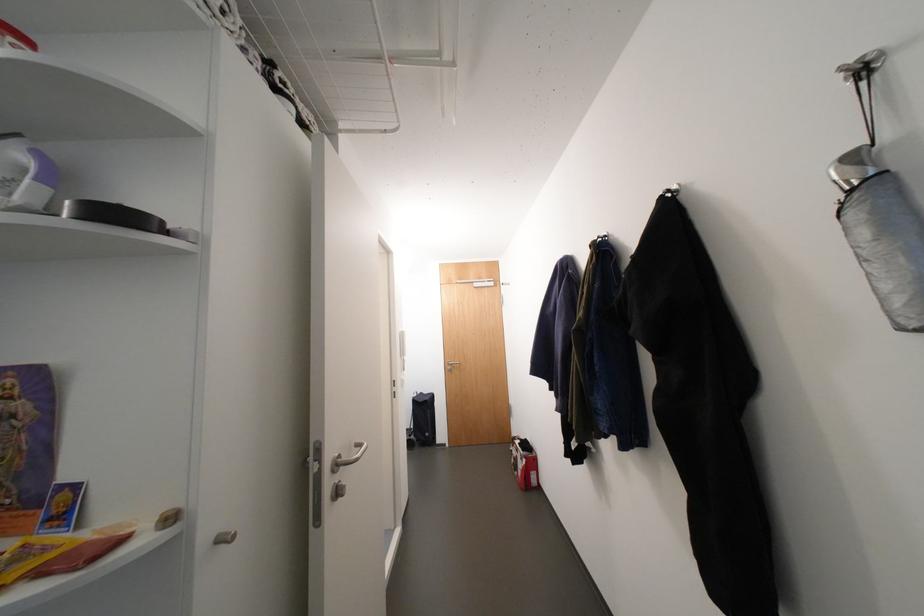
Where would you pull the silver cabinet knob? Please return your answer as a coordinate pair (x, y).

(337, 490)